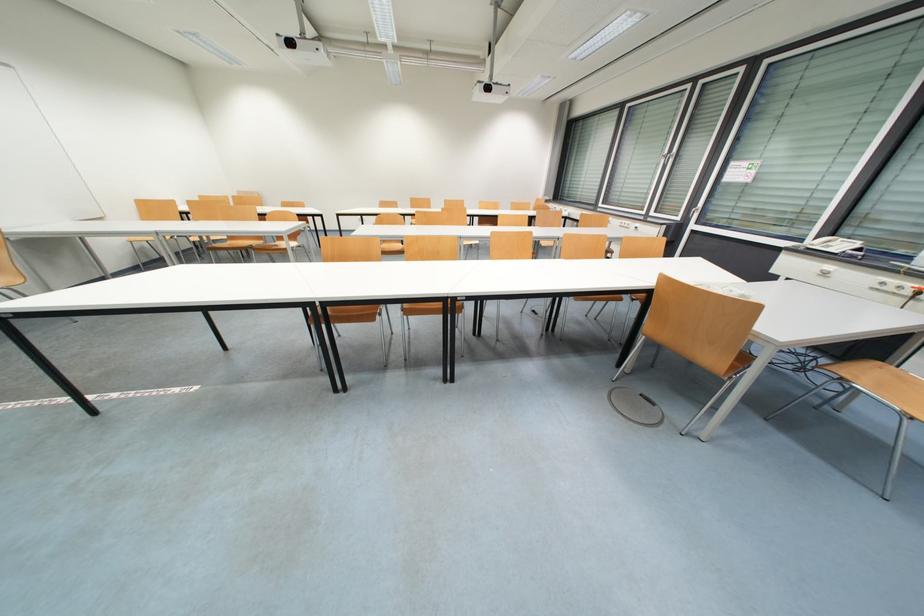
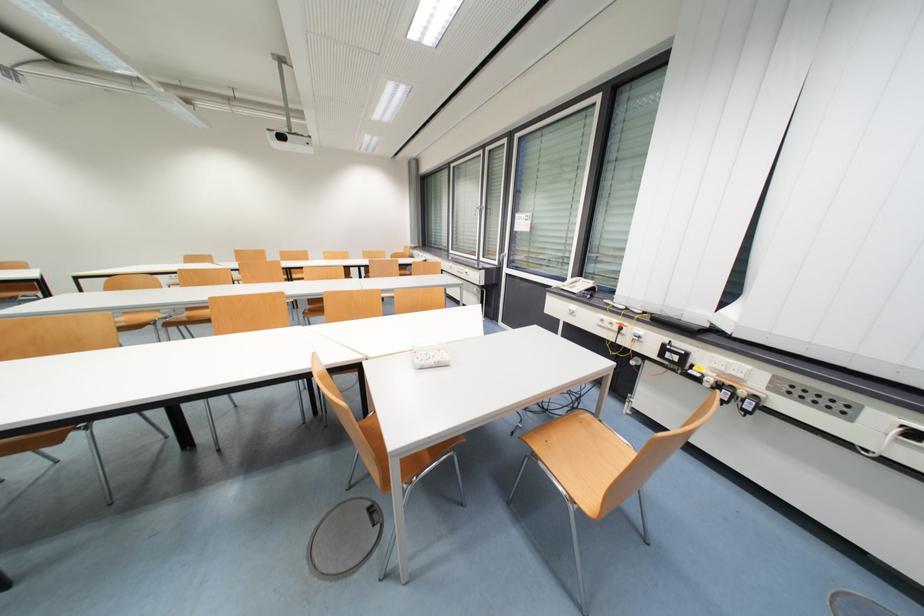
Locate, in the second image, the point that corresponds to point 835,269 in the first image.

(578, 309)